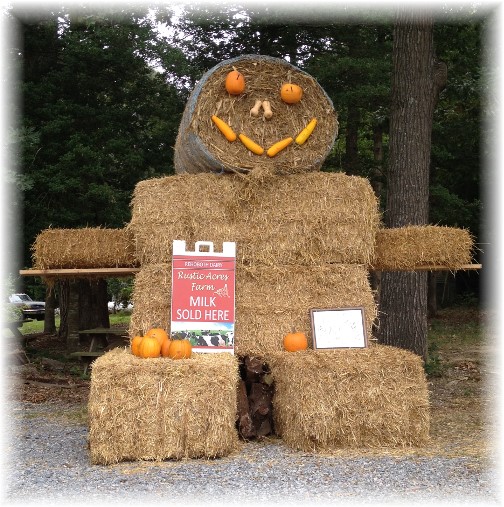
At what (x,y) coordinates should I click in order to perform the action: click on wooden board. Please return your answer as a coordinate pair (x, y). The image size is (504, 507). Looking at the image, I should click on (90, 271), (436, 267).